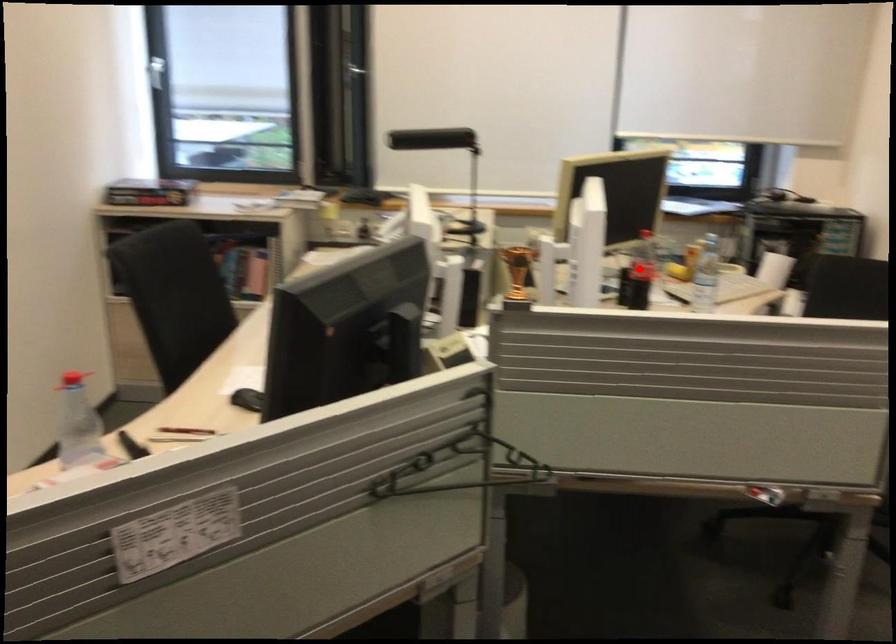
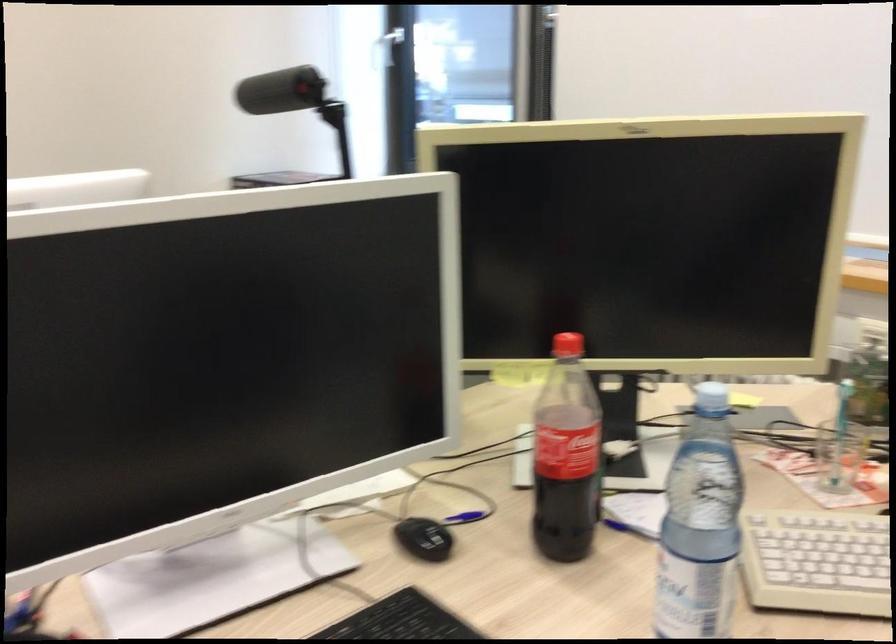
Find the pixel in the second image that matches the highlighted location in the first image.

(565, 456)